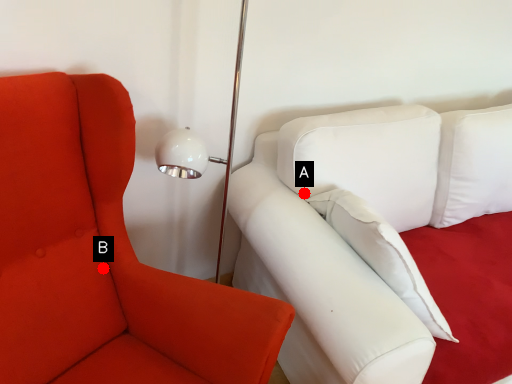
Question: Two points are circled on the image, labeled by A and B beside each circle. Which point appears farthest from the camera in this image?

Choices:
 (A) A is further
 (B) B is further

Answer: (A)